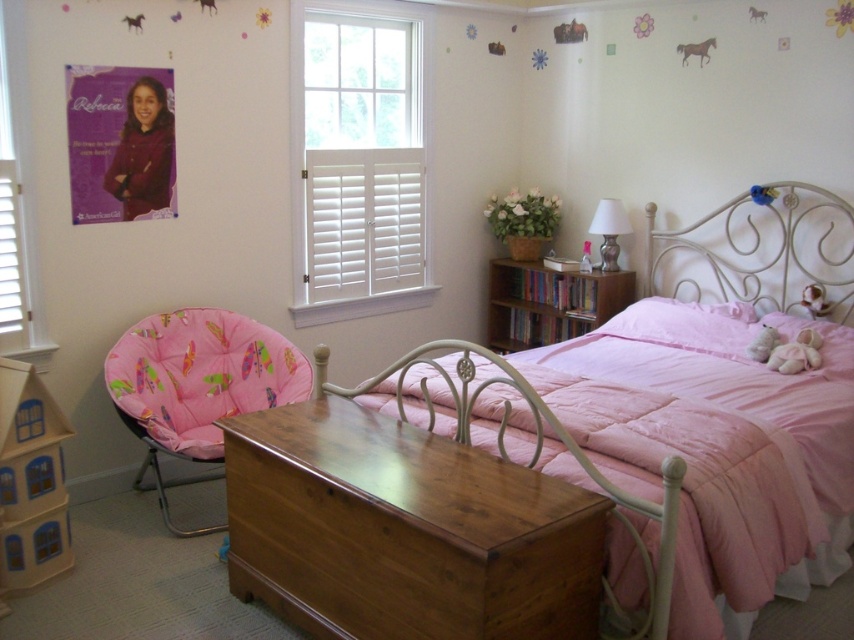
Question: Is wooden dollhouse at lower left wider than white plush bear at upper right?

Choices:
 (A) yes
 (B) no

Answer: (A)

Question: Which of these objects is positioned farthest from the wooden dollhouse at lower left?

Choices:
 (A) white glossy lamp at upper right
 (B) pink plush pillow at center

Answer: (B)

Question: Can you confirm if matte pink bed at center is positioned below matte pink teddy bear at center?

Choices:
 (A) yes
 (B) no

Answer: (A)

Question: Which object appears closest to the camera in this image?

Choices:
 (A) pink satin pillow at center
 (B) white glossy lamp at upper right
 (C) fluffy pink teddy bear at bed

Answer: (C)

Question: Is pink fabric chair at lower left to the right of wooden dollhouse at lower left from the viewer's perspective?

Choices:
 (A) yes
 (B) no

Answer: (A)

Question: Estimate the real-world distances between objects in this image. Which object is closer to the matte pink bed at center?

Choices:
 (A) white plush toy at right
 (B) pink plush pillow at center
 (C) pink satin pillow at center
 (D) pink fabric chair at lower left

Answer: (C)